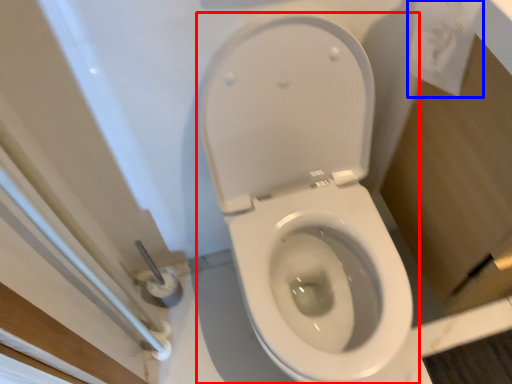
Question: Which object appears farthest to the camera in this image, toilet (highlighted by a red box) or toilet paper (highlighted by a blue box)?

Choices:
 (A) toilet
 (B) toilet paper

Answer: (B)